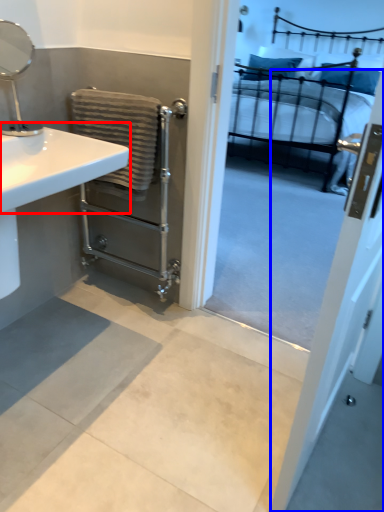
Question: Which point is closer to the camera, counter top (highlighted by a red box) or screen door (highlighted by a blue box)?

Choices:
 (A) counter top
 (B) screen door

Answer: (B)